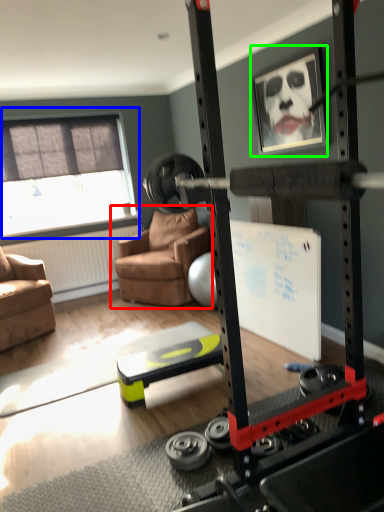
Question: Based on their relative distances, which object is farther from chair (highlighted by a red box)? Choose from window (highlighted by a blue box) and picture frame (highlighted by a green box).

Choices:
 (A) window
 (B) picture frame

Answer: (B)